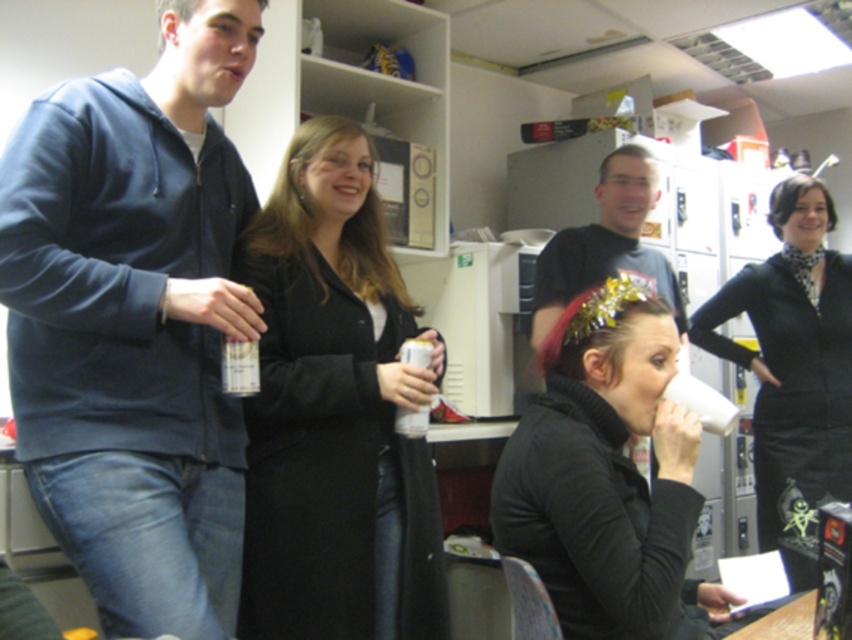
Question: Is matte black coat at center positioned behind matte black turtleneck at center?

Choices:
 (A) yes
 (B) no

Answer: (A)

Question: Does matte blue hoodie at left have a smaller size compared to dark gray t-shirt at center?

Choices:
 (A) no
 (B) yes

Answer: (A)

Question: Which point is closer to the camera taking this photo?

Choices:
 (A) (366, 624)
 (B) (153, 225)
 (C) (594, 556)
 (D) (570, 266)

Answer: (C)

Question: Among these objects, which one is nearest to the camera?

Choices:
 (A) matte black turtleneck at center
 (B) matte black coat at center
 (C) black matte dress at right
 (D) dark gray t-shirt at center

Answer: (A)

Question: Based on their relative distances, which object is farther from the dark gray t-shirt at center?

Choices:
 (A) matte blue hoodie at left
 (B) matte black coat at center

Answer: (A)

Question: Does matte blue hoodie at left appear over matte black coat at center?

Choices:
 (A) yes
 (B) no

Answer: (A)